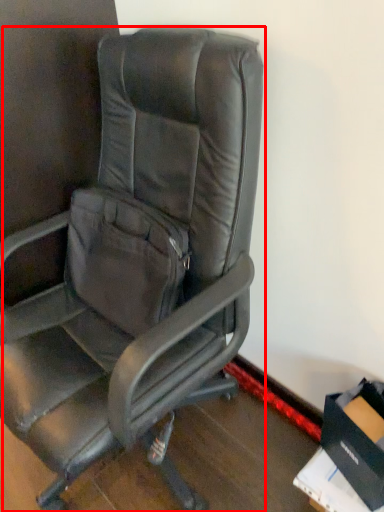
Question: From the image's perspective, where is chair (annotated by the red box) located relative to cardboard box?

Choices:
 (A) above
 (B) below

Answer: (A)